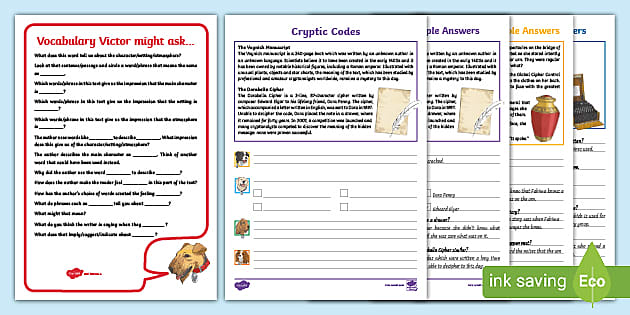
Where is `wood box`? The width and height of the screenshot is (630, 315). wood box is located at coordinates (592, 119).